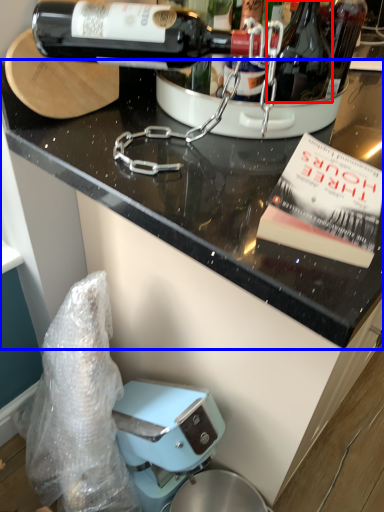
Question: Which point is further to the camera, bottle (highlighted by a red box) or countertop (highlighted by a blue box)?

Choices:
 (A) bottle
 (B) countertop

Answer: (A)